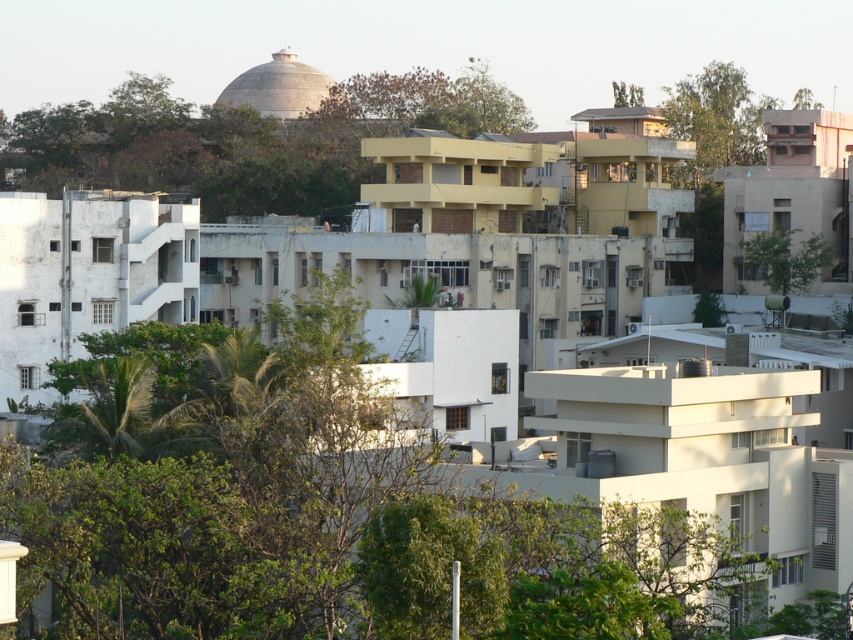
Question: Where is brown leafy tree at upper center located in relation to green leafy tree at right in the image?

Choices:
 (A) right
 (B) left

Answer: (B)

Question: Is brown leafy tree at upper center positioned before green leafy tree at right?

Choices:
 (A) no
 (B) yes

Answer: (A)

Question: Which of the following is the closest to the observer?

Choices:
 (A) brown leafy tree at upper center
 (B) green leafy tree at right

Answer: (B)

Question: Among these objects, which one is nearest to the camera?

Choices:
 (A) green leafy tree at right
 (B) brown leafy tree at upper center

Answer: (A)

Question: Does brown leafy tree at upper center have a greater width compared to green leafy tree at right?

Choices:
 (A) no
 (B) yes

Answer: (B)

Question: Which point is closer to the camera taking this photo?

Choices:
 (A) (795, 269)
 (B) (90, 138)

Answer: (A)